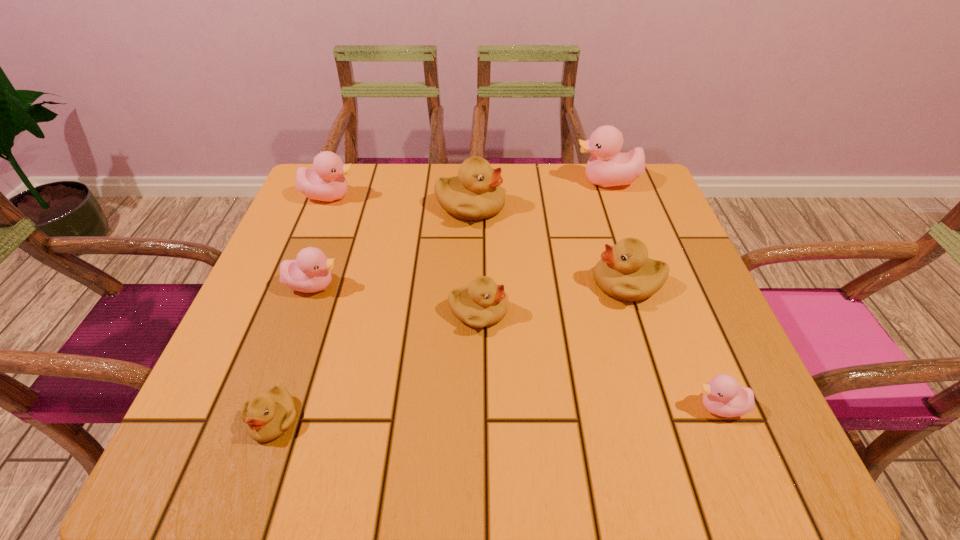
You are a GUI agent. You are given a task and a screenshot of the screen. Output one action in this format:
    pyautogui.click(x=<x>, y=<y>)
    Task: Click on the blank space located on the front-facing side of the nearest pink duckling
    The image size is (960, 540).
    Given the screenshot: What is the action you would take?
    pyautogui.click(x=661, y=407)

This screenshot has width=960, height=540. Find the location of `free location located 0.300m on the front-facing side of the nearest pink duckling`. free location located 0.300m on the front-facing side of the nearest pink duckling is located at coordinates (510, 407).

Find the location of a particular element. The image size is (960, 540). object present at the far left corner is located at coordinates (326, 182).

The height and width of the screenshot is (540, 960). I want to click on object at the near left corner, so click(x=267, y=416).

Locate an element on the screen. The height and width of the screenshot is (540, 960). object that is at the far right corner is located at coordinates (607, 167).

The width and height of the screenshot is (960, 540). I want to click on object that is positioned at the near right corner, so click(722, 396).

Find the location of a particular element. blank area at the far edge is located at coordinates (561, 193).

Locate an element on the screen. This screenshot has width=960, height=540. vacant space at the near edge is located at coordinates (333, 432).

In the image, there is a desktop. Identify the location of vacant region at the right edge. This screenshot has height=540, width=960. (684, 253).

In order to click on vacant space at the far left corner of the desktop in this screenshot , I will do `click(362, 167)`.